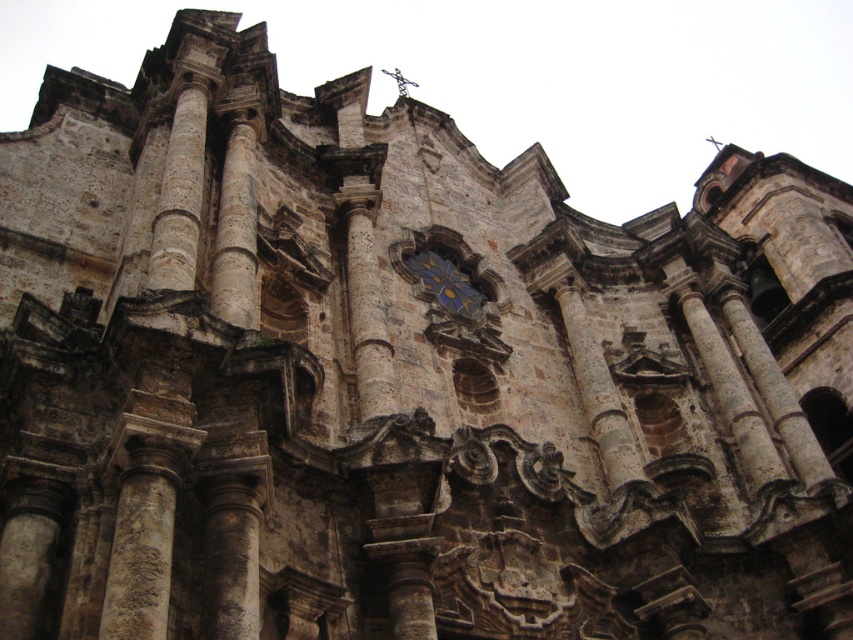
You are an architect examining the church facade. You need to determine which of the two elements, the stone column at center or the blue glass mosaic at center, is taller. Based on the image, which one is taller?

The stone column at center is taller than the blue glass mosaic at center according to the description.

You are standing in front of the historic stone church. You notice the stone column at center and the blue glass mosaic at center. Which object is closer to you?

The stone column at center is closer to you because it is in front of the blue glass mosaic at center.